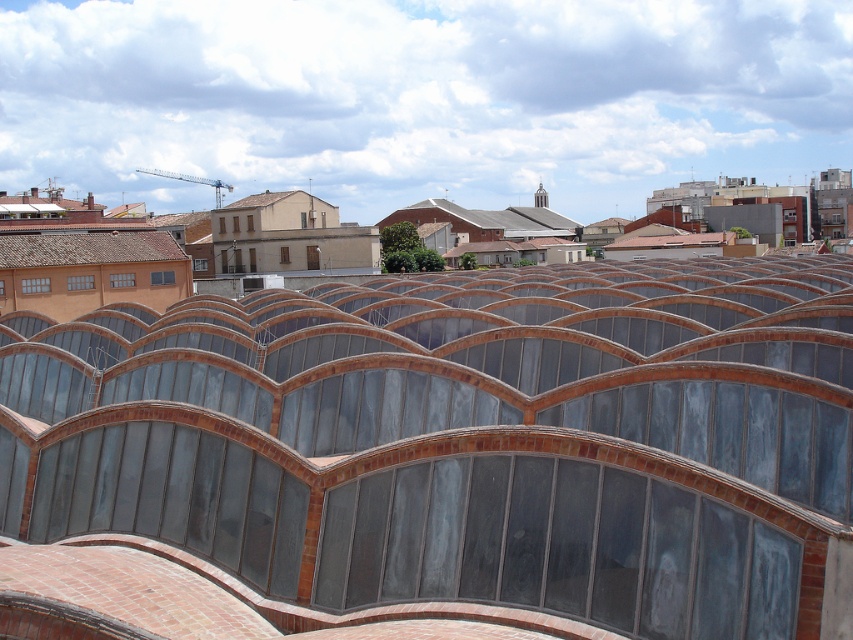
Question: Does brown brick tile roof at center appear on the right side of terracotta tiled roof at left?

Choices:
 (A) no
 (B) yes

Answer: (B)

Question: Which of the following is the closest to the observer?

Choices:
 (A) brown brick tile roof at center
 (B) terracotta tiled roof at left

Answer: (A)

Question: Can you confirm if brown brick tile roof at center is positioned to the left of terracotta tiled roof at left?

Choices:
 (A) yes
 (B) no

Answer: (B)

Question: Which object appears closest to the camera in this image?

Choices:
 (A) brown brick tile roof at center
 (B) terracotta tiled roof at left

Answer: (A)

Question: Does brown brick tile roof at center have a larger size compared to terracotta tiled roof at left?

Choices:
 (A) yes
 (B) no

Answer: (A)

Question: Which of the following is the closest to the observer?

Choices:
 (A) click(x=73, y=241)
 (B) click(x=498, y=508)

Answer: (B)